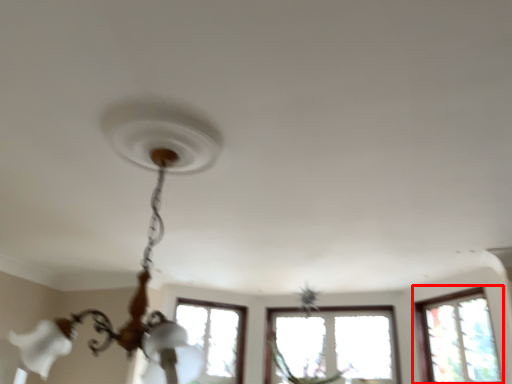
Question: From the image's perspective, where is window (annotated by the red box) located relative to lamp?

Choices:
 (A) below
 (B) above

Answer: (A)